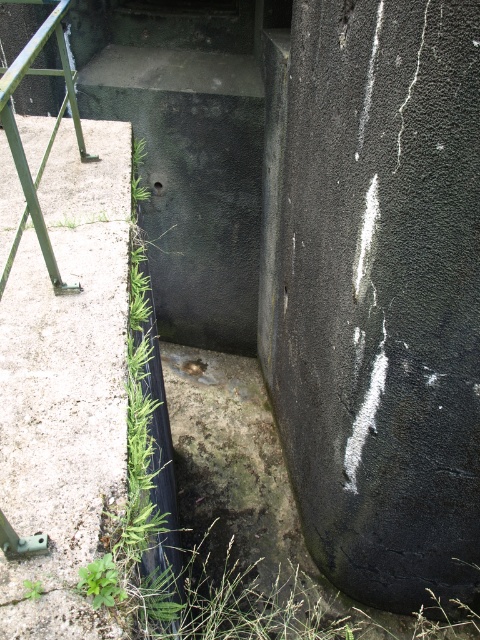
Question: Considering the relative positions of gray concrete at left and green leafy weed at lower left in the image provided, where is gray concrete at left located with respect to green leafy weed at lower left?

Choices:
 (A) above
 (B) below

Answer: (A)

Question: Among these objects, which one is nearest to the camera?

Choices:
 (A) green leafy weed at lower left
 (B) green metal rail at left
 (C) gray concrete at left

Answer: (C)

Question: Which of the following is the farthest from the observer?

Choices:
 (A) green metal rail at left
 (B) green leafy weed at lower left

Answer: (A)

Question: Estimate the real-world distances between objects in this image. Which object is farther from the green metal rail at left?

Choices:
 (A) green leafy weed at lower left
 (B) gray concrete at left

Answer: (A)

Question: Does green metal rail at left have a smaller size compared to green leafy weed at lower left?

Choices:
 (A) no
 (B) yes

Answer: (A)

Question: Does green metal rail at left come behind green leafy weed at lower left?

Choices:
 (A) no
 (B) yes

Answer: (B)